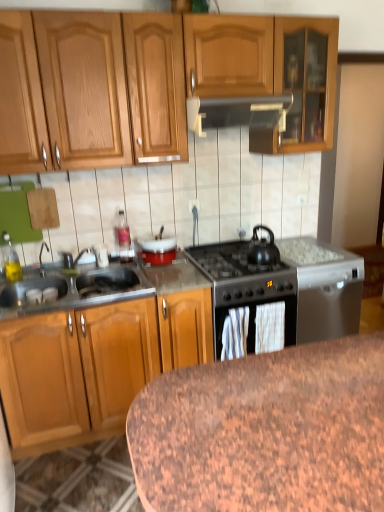
I want to click on black matte gas stove at center, so click(x=238, y=265).

In order to face translucent glass bottle at upper center, the 1th appliance positioned from the left, should I rotate leftwards or rightwards?

A 9.043 degree turn to the left will do.

In order to face metallic gray dishwasher at right, which ranks as the 3th appliance in left-to-right order, should I rotate leftwards or rightwards?

Rotate right and turn 14.837 degrees.

Locate an element on the screen. This screenshot has height=512, width=384. black matte tea pot at center-right is located at coordinates (262, 248).

Find the location of `black matte gas stove at center`. black matte gas stove at center is located at coordinates (238, 265).

Which object is thinner, granite table at lower center or metallic gray range hood at center?

metallic gray range hood at center.

From the image's perspective, is granite table at lower center positioned above or below metallic gray range hood at center?

granite table at lower center is below metallic gray range hood at center.

Find the location of a particular element. Image resolution: width=384 pixels, height=512 pixels. table on the right side of metallic gray range hood at center is located at coordinates (265, 432).

From the image's perspective, would you say translucent glass bottle at upper center, the 1th appliance positioned from the left, is positioned over black matte gas stove at center?

Yes.

Can you tell me how much translucent glass bottle at upper center, which ranks as the third appliance in right-to-left order, and black matte gas stove at center differ in facing direction?

The angle between the facing direction of translucent glass bottle at upper center, which ranks as the third appliance in right-to-left order, and the facing direction of black matte gas stove at center is 0.0033 degrees.

Is translucent glass bottle at upper center, the 1th appliance positioned from the left, bigger than black matte gas stove at center?

Actually, translucent glass bottle at upper center, the 1th appliance positioned from the left, might be smaller than black matte gas stove at center.

Consider the image. Is translucent glass bottle at upper center, the 1th appliance positioned from the left, beside black matte gas stove at center?

translucent glass bottle at upper center, the 1th appliance positioned from the left, and black matte gas stove at center are not in contact.

Where is `appliance that is the 1st object to the left of the black matte gas stove at center, starting at the anchor`? The height and width of the screenshot is (512, 384). appliance that is the 1st object to the left of the black matte gas stove at center, starting at the anchor is located at coordinates (157, 249).

From a real-world perspective, is black matte gas stove at center on white glossy bowl at center, which ranks as the 2th appliance in left-to-right order?

No.

Does black matte gas stove at center have a larger size compared to white glossy bowl at center, which ranks as the 2th appliance in right-to-left order?

Yes, black matte gas stove at center is bigger than white glossy bowl at center, which ranks as the 2th appliance in right-to-left order.

Who is taller, black matte gas stove at center or white glossy bowl at center, which ranks as the 2th appliance in left-to-right order?

black matte gas stove at center is taller.

Is black matte tea pot at center-right at the left side of translucent glass bottle at upper center, the 1th appliance positioned from the left?

No, black matte tea pot at center-right is not to the left of translucent glass bottle at upper center, the 1th appliance positioned from the left.

Is black matte tea pot at center-right in contact with translucent glass bottle at upper center, the 1th appliance positioned from the left?

black matte tea pot at center-right is not next to translucent glass bottle at upper center, the 1th appliance positioned from the left, and they're not touching.

Is point (255, 251) in front of point (127, 261)?

Yes.

Is black matte tea pot at center-right positioned beyond the bounds of translucent glass bottle at upper center, the 1th appliance positioned from the left?

black matte tea pot at center-right is positioned outside translucent glass bottle at upper center, the 1th appliance positioned from the left.

From a real-world perspective, who is located higher, black matte tea pot at center-right or metallic gray dishwasher at right, which is counted as the 1th appliance, starting from the right?

black matte tea pot at center-right.

Is black matte tea pot at center-right with metallic gray dishwasher at right, which ranks as the 3th appliance in left-to-right order?

No, black matte tea pot at center-right is not making contact with metallic gray dishwasher at right, which ranks as the 3th appliance in left-to-right order.

Considering the relative positions of black matte tea pot at center-right and metallic gray dishwasher at right, which is counted as the 1th appliance, starting from the right, in the image provided, is black matte tea pot at center-right to the right of metallic gray dishwasher at right, which is counted as the 1th appliance, starting from the right, from the viewer's perspective?

No.

Between stainless steel sink at left and black matte tea pot at center-right, which one is positioned behind?

black matte tea pot at center-right is further from the camera.

Considering the points (25, 287) and (254, 245), which point is in front, point (25, 287) or point (254, 245)?

Point (25, 287)

Does stainless steel sink at left appear on the left side of black matte tea pot at center-right?

Yes, stainless steel sink at left is to the left of black matte tea pot at center-right.

Does stainless steel sink at left have a smaller size compared to black matte tea pot at center-right?

Actually, stainless steel sink at left might be larger than black matte tea pot at center-right.

Which is in front, white glossy bowl at center, which ranks as the 2th appliance in left-to-right order, or black matte tea pot at center-right?

black matte tea pot at center-right is more forward.

Is black matte tea pot at center-right at the back of white glossy bowl at center, which ranks as the 2th appliance in right-to-left order?

No, white glossy bowl at center, which ranks as the 2th appliance in right-to-left order,'s orientation is not away from black matte tea pot at center-right.

At what (x,y) coordinates should I click in order to perform the action: click on the 2nd appliance behind the black matte tea pot at center-right, starting your count from the anchor. Please return your answer as a coordinate pair (x, y). The height and width of the screenshot is (512, 384). Looking at the image, I should click on (157, 249).

Can you confirm if white glossy bowl at center, which ranks as the 2th appliance in right-to-left order, is positioned to the right of black matte tea pot at center-right?

No.

In the image, there is a metallic gray range hood at center. What are the coordinates of `table below it (from the image's perspective)` in the screenshot? It's located at (265, 432).

You are a GUI agent. You are given a task and a screenshot of the screen. Output one action in this format:
    pyautogui.click(x=<x>, y=<y>)
    Task: Click on the gas stove in front of the translucent glass bottle at upper center, the 1th appliance positioned from the left
    This screenshot has width=384, height=512.
    Given the screenshot: What is the action you would take?
    pyautogui.click(x=238, y=265)

Looking at the image, which one is located further to granite table at lower center, brushed metal faucet at sink left or metallic gray range hood at center?

Based on the image, brushed metal faucet at sink left appears to be further to granite table at lower center.

Which object lies nearer to the anchor point black matte tea pot at center-right, translucent glass bottle at upper center, which ranks as the third appliance in right-to-left order, or white glossy bowl at center, which ranks as the 2th appliance in right-to-left order?

white glossy bowl at center, which ranks as the 2th appliance in right-to-left order.

From the image, which object appears to be nearer to translucent glass bottle at upper center, the 1th appliance positioned from the left, metallic gray dishwasher at right, which is counted as the 1th appliance, starting from the right, or metallic gray range hood at center?

metallic gray range hood at center lies closer to translucent glass bottle at upper center, the 1th appliance positioned from the left, than the other object.

Considering their positions, is translucent glass bottle at upper center, the 1th appliance positioned from the left, positioned closer to metallic gray range hood at center than black matte tea pot at center-right?

black matte tea pot at center-right lies closer to metallic gray range hood at center than the other object.

Looking at the image, which one is located closer to white glossy bowl at center, which ranks as the 2th appliance in right-to-left order, metallic gray dishwasher at right, which ranks as the 3th appliance in left-to-right order, or metallic gray range hood at center?

metallic gray range hood at center lies closer to white glossy bowl at center, which ranks as the 2th appliance in right-to-left order, than the other object.

From the image, which object appears to be farther from black matte tea pot at center-right, metallic gray dishwasher at right, which ranks as the 3th appliance in left-to-right order, or translucent glass bottle at upper center, which ranks as the third appliance in right-to-left order?

Among the two, translucent glass bottle at upper center, which ranks as the third appliance in right-to-left order, is located further to black matte tea pot at center-right.

Looking at the image, which one is located closer to white glossy bowl at center, which ranks as the 2th appliance in right-to-left order, stainless steel sink at left or metallic gray dishwasher at right, which is counted as the 1th appliance, starting from the right?

Among the two, stainless steel sink at left is located nearer to white glossy bowl at center, which ranks as the 2th appliance in right-to-left order.

Estimate the real-world distances between objects in this image. Which object is further from brushed metal faucet at sink left, black matte gas stove at center or metallic gray dishwasher at right, which is counted as the 1th appliance, starting from the right?

The object further to brushed metal faucet at sink left is metallic gray dishwasher at right, which is counted as the 1th appliance, starting from the right.

Where is `gas stove between granite table at lower center and metallic gray dishwasher at right, which is counted as the 1th appliance, starting from the right, in the front-back direction`? This screenshot has width=384, height=512. gas stove between granite table at lower center and metallic gray dishwasher at right, which is counted as the 1th appliance, starting from the right, in the front-back direction is located at coordinates (238, 265).

Where is `gas stove between granite table at lower center and brushed metal faucet at sink left from front to back`? gas stove between granite table at lower center and brushed metal faucet at sink left from front to back is located at coordinates (238, 265).

Image resolution: width=384 pixels, height=512 pixels. In order to click on kitchen appliance situated between translucent glass bottle at upper center, which ranks as the third appliance in right-to-left order, and metallic gray dishwasher at right, which ranks as the 3th appliance in left-to-right order, from left to right in this screenshot , I will do `click(238, 112)`.

You are a GUI agent. You are given a task and a screenshot of the screen. Output one action in this format:
    pyautogui.click(x=<x>, y=<y>)
    Task: Click on the gas stove located between granite table at lower center and white glossy bowl at center, which ranks as the 2th appliance in left-to-right order, in the depth direction
    
    Given the screenshot: What is the action you would take?
    pyautogui.click(x=238, y=265)